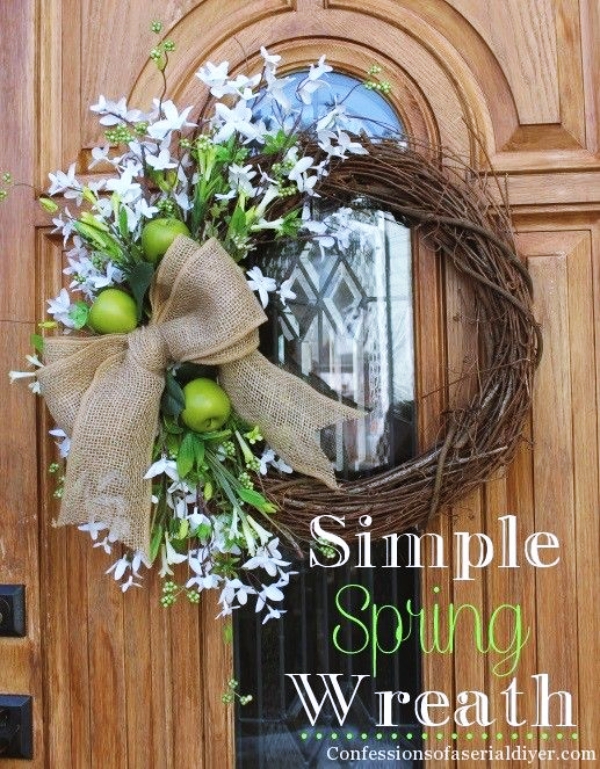
Where is `white fake flowers`? The width and height of the screenshot is (600, 769). white fake flowers is located at coordinates (305, 148), (150, 160), (242, 221), (240, 95), (168, 495), (248, 547), (168, 573).